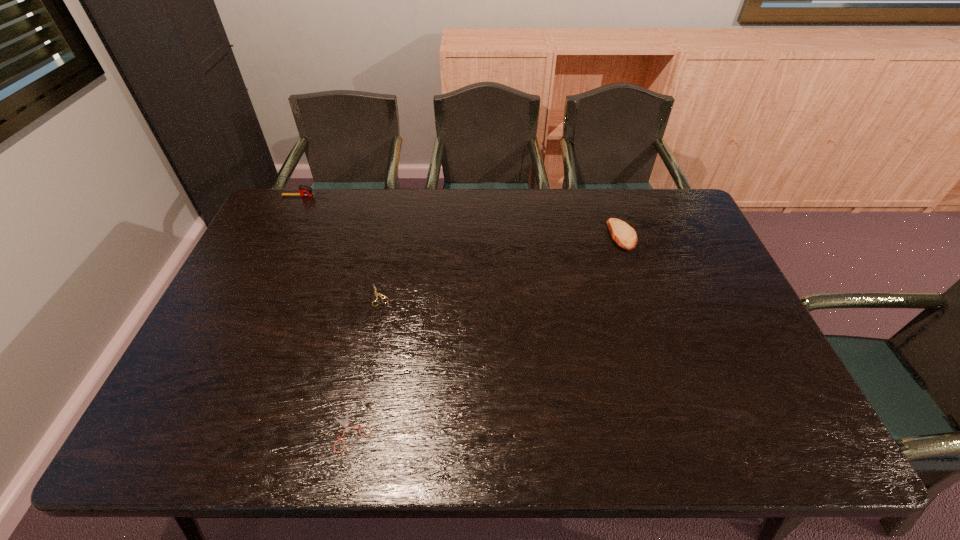
Find the location of a particular element. This screenshot has height=540, width=960. free space located 0.130m on the left of the taller shears is located at coordinates (324, 295).

At what (x,y) coordinates should I click in order to perform the action: click on vacant space located 0.330m on the left of the shortest object. Please return your answer as a coordinate pair (x, y). The width and height of the screenshot is (960, 540). Looking at the image, I should click on (182, 431).

At what (x,y) coordinates should I click in order to perform the action: click on tape measure located in the far edge section of the desktop. Please return your answer as a coordinate pair (x, y). Image resolution: width=960 pixels, height=540 pixels. Looking at the image, I should click on (305, 190).

Where is `pita bread that is at the far edge`? pita bread that is at the far edge is located at coordinates (624, 235).

Locate an element on the screen. The width and height of the screenshot is (960, 540). object located in the near edge section of the desktop is located at coordinates (346, 423).

Find the location of a particular element. Image resolution: width=960 pixels, height=540 pixels. object situated at the left edge is located at coordinates (305, 190).

Where is `object positioned at the far left corner`? This screenshot has width=960, height=540. object positioned at the far left corner is located at coordinates (305, 190).

Locate an element on the screen. The height and width of the screenshot is (540, 960). free space at the far edge of the desktop is located at coordinates (574, 191).

You are a GUI agent. You are given a task and a screenshot of the screen. Output one action in this format:
    pyautogui.click(x=<x>, y=<y>)
    Task: Click on the vacant space at the near edge of the desktop
    
    Given the screenshot: What is the action you would take?
    pyautogui.click(x=410, y=443)

In the image, there is a desktop. Find the location of `free region at the right edge`. free region at the right edge is located at coordinates (755, 381).